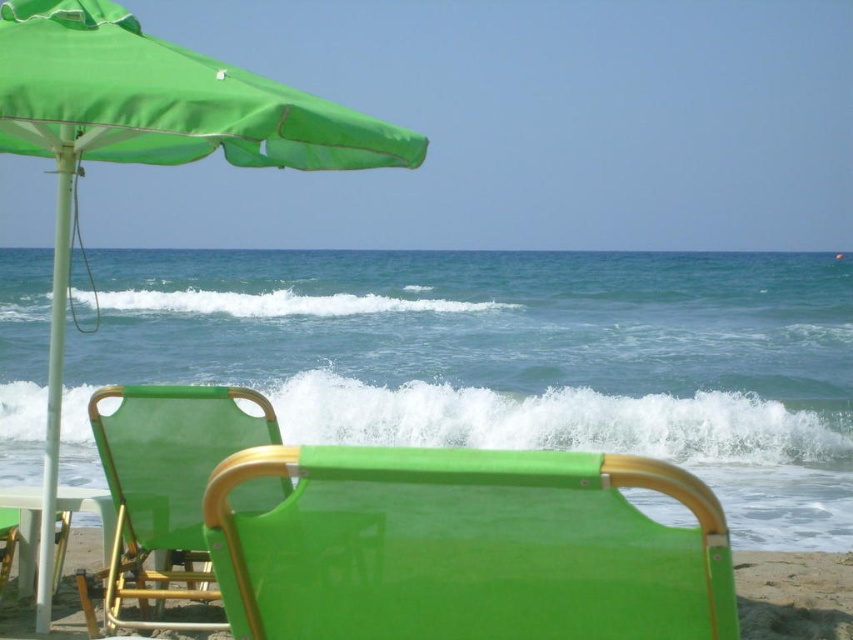
You are planning to set up a small tent between the green fabric beach chair at center and the green fabric umbrella at upper left. Considering their heights, which object will cast a longer shadow on the sand?

The green fabric umbrella at upper left is taller than the green fabric beach chair at center, so it will cast a longer shadow on the sand.

From the picture: You are planning to set up a beach umbrella and a chair for a sunny day. Based on the scene, which object is bigger between the green fabric umbrella at upper left and the matte green fabric beach chair at lower left?

The green fabric umbrella at upper left is larger in size than the matte green fabric beach chair at lower left.

You are a photographer setting up equipment on the beach. You need to place a large tripod between the green fabric beach chair at center and the matte green fabric beach chair at lower left. Which chair should you position the tripod closer to so it doesn

The green fabric beach chair at center is in front of the matte green fabric beach chair at lower left. To place the tripod between them, position it closer to the matte green fabric beach chair at lower left since it is behind the other chair.